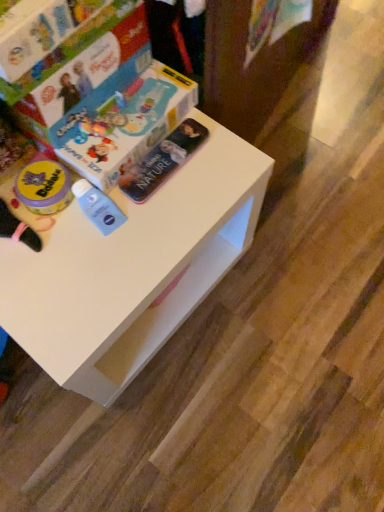
This screenshot has height=512, width=384. What do you see at coordinates (125, 263) in the screenshot? I see `white matte table at center` at bounding box center [125, 263].

Find the location of a particular element. This screenshot has width=384, height=512. hardcover book at upper left, the second paperback book ordered from the bottom is located at coordinates (81, 67).

At what (x,y) coordinates should I click in order to perform the action: click on white matte table at center. Please return your answer as a coordinate pair (x, y). Looking at the image, I should click on 125,263.

Based on the photo, is metallic silver book at center, positioned as the 2th paperback book in top-to-bottom order, aimed at hardcover book at upper left, the second paperback book ordered from the bottom?

No, metallic silver book at center, positioned as the 2th paperback book in top-to-bottom order, is not facing towards hardcover book at upper left, the second paperback book ordered from the bottom.

Between metallic silver book at center, marked as the 1th paperback book in a bottom-to-top arrangement, and hardcover book at upper left, which is the first paperback book from top to bottom, which one has more height?

With more height is hardcover book at upper left, which is the first paperback book from top to bottom.

Can you confirm if metallic silver book at center, marked as the 1th paperback book in a bottom-to-top arrangement, is thinner than hardcover book at upper left, the second paperback book ordered from the bottom?

Indeed, metallic silver book at center, marked as the 1th paperback book in a bottom-to-top arrangement, has a lesser width compared to hardcover book at upper left, the second paperback book ordered from the bottom.

Which is behind, point (192, 154) or point (74, 77)?

The point (192, 154) is farther from the camera.

From a real-world perspective, is metallic silver book at center, marked as the 1th paperback book in a bottom-to-top arrangement, positioned under white matte table at center based on gravity?

No, from a real-world perspective, metallic silver book at center, marked as the 1th paperback book in a bottom-to-top arrangement, is not below white matte table at center.

Consider the image. Can you tell me how much metallic silver book at center, marked as the 1th paperback book in a bottom-to-top arrangement, and white matte table at center differ in facing direction?

They differ by 0.000974 degrees in their facing directions.

Considering the sizes of objects metallic silver book at center, marked as the 1th paperback book in a bottom-to-top arrangement, and white matte table at center in the image provided, who is thinner, metallic silver book at center, marked as the 1th paperback book in a bottom-to-top arrangement, or white matte table at center?

metallic silver book at center, marked as the 1th paperback book in a bottom-to-top arrangement.

Is metallic silver book at center, marked as the 1th paperback book in a bottom-to-top arrangement, facing away from white matte table at center?

No.

From a real-world perspective, between white matte table at center and metallic silver book at center, marked as the 1th paperback book in a bottom-to-top arrangement, who is vertically lower?

white matte table at center is physically lower.

Is point (230, 206) closer to camera compared to point (164, 173)?

Yes, it is.

Locate an element on the screen. This screenshot has height=512, width=384. table in front of the metallic silver book at center, positioned as the 2th paperback book in top-to-bottom order is located at coordinates (125, 263).

Which is correct: white matte table at center is inside metallic silver book at center, marked as the 1th paperback book in a bottom-to-top arrangement, or outside of it?

white matte table at center cannot be found inside metallic silver book at center, marked as the 1th paperback book in a bottom-to-top arrangement.

Between hardcover book at upper left, the second paperback book ordered from the bottom, and white matte table at center, which one has less height?

hardcover book at upper left, the second paperback book ordered from the bottom, is shorter.

Which is nearer, (49, 92) or (228, 254)?

The point (49, 92) is in front.

Relative to white matte table at center, is hardcover book at upper left, the second paperback book ordered from the bottom, in front or behind?

Clearly, hardcover book at upper left, the second paperback book ordered from the bottom, is behind white matte table at center.

Can you tell me how much hardcover book at upper left, the second paperback book ordered from the bottom, and metallic silver book at center, positioned as the 2th paperback book in top-to-bottom order, differ in facing direction?

hardcover book at upper left, the second paperback book ordered from the bottom, and metallic silver book at center, positioned as the 2th paperback book in top-to-bottom order, are facing 0.0013 degrees away from each other.

Considering the sizes of objects hardcover book at upper left, the second paperback book ordered from the bottom, and metallic silver book at center, positioned as the 2th paperback book in top-to-bottom order, in the image provided, who is taller, hardcover book at upper left, the second paperback book ordered from the bottom, or metallic silver book at center, positioned as the 2th paperback book in top-to-bottom order,?

With more height is hardcover book at upper left, the second paperback book ordered from the bottom.

Between point (50, 119) and point (175, 157), which one is positioned in front?

The point (50, 119) is more forward.

Is metallic silver book at center, marked as the 1th paperback book in a bottom-to-top arrangement, inside hardcover book at upper left, the second paperback book ordered from the bottom?

No, metallic silver book at center, marked as the 1th paperback book in a bottom-to-top arrangement, is not a part of hardcover book at upper left, the second paperback book ordered from the bottom.

Between white matte table at center and hardcover book at upper left, which is the first paperback book from top to bottom, which one has smaller size?

hardcover book at upper left, which is the first paperback book from top to bottom.

Are white matte table at center and hardcover book at upper left, which is the first paperback book from top to bottom, making contact?

No, white matte table at center is not making contact with hardcover book at upper left, which is the first paperback book from top to bottom.

Considering the relative positions of white matte table at center and hardcover book at upper left, which is the first paperback book from top to bottom, in the image provided, is white matte table at center behind hardcover book at upper left, which is the first paperback book from top to bottom,?

No.

Identify the location of paperback book to the right of hardcover book at upper left, the second paperback book ordered from the bottom. Image resolution: width=384 pixels, height=512 pixels. (163, 160).

From the white matte table at center, count 2nd paperback books backward and point to it. Please provide its 2D coordinates.

[(163, 160)]

Considering their positions, is white matte table at center positioned further to metallic silver book at center, positioned as the 2th paperback book in top-to-bottom order, than hardcover book at upper left, which is the first paperback book from top to bottom?

white matte table at center is positioned further to the anchor metallic silver book at center, positioned as the 2th paperback book in top-to-bottom order.

Estimate the real-world distances between objects in this image. Which object is further from white matte table at center, metallic silver book at center, marked as the 1th paperback book in a bottom-to-top arrangement, or hardcover book at upper left, which is the first paperback book from top to bottom?

The object further to white matte table at center is hardcover book at upper left, which is the first paperback book from top to bottom.

When comparing their distances from hardcover book at upper left, the second paperback book ordered from the bottom, does white matte table at center or metallic silver book at center, marked as the 1th paperback book in a bottom-to-top arrangement, seem closer?

metallic silver book at center, marked as the 1th paperback book in a bottom-to-top arrangement, lies closer to hardcover book at upper left, the second paperback book ordered from the bottom, than the other object.

When comparing their distances from metallic silver book at center, positioned as the 2th paperback book in top-to-bottom order, does hardcover book at upper left, which is the first paperback book from top to bottom, or white matte table at center seem further?

white matte table at center is further to metallic silver book at center, positioned as the 2th paperback book in top-to-bottom order.

When comparing their distances from white matte table at center, does hardcover book at upper left, which is the first paperback book from top to bottom, or metallic silver book at center, positioned as the 2th paperback book in top-to-bottom order, seem further?

hardcover book at upper left, which is the first paperback book from top to bottom, lies further to white matte table at center than the other object.

Looking at the image, which one is located further to hardcover book at upper left, the second paperback book ordered from the bottom, metallic silver book at center, marked as the 1th paperback book in a bottom-to-top arrangement, or white matte table at center?

white matte table at center.

The height and width of the screenshot is (512, 384). Find the location of `paperback book that lies between hardcover book at upper left, the second paperback book ordered from the bottom, and white matte table at center from top to bottom`. paperback book that lies between hardcover book at upper left, the second paperback book ordered from the bottom, and white matte table at center from top to bottom is located at coordinates (163, 160).